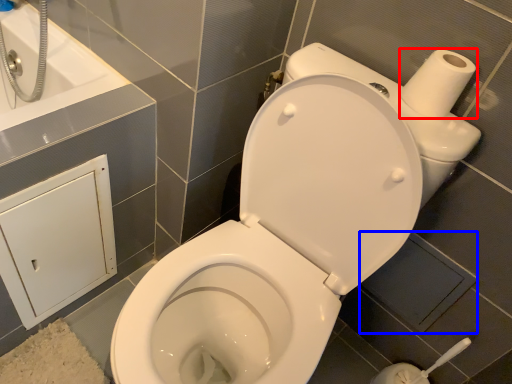
Question: Which of the following is the closest to the observer, toilet paper (highlighted by a red box) or square (highlighted by a blue box)?

Choices:
 (A) toilet paper
 (B) square

Answer: (A)